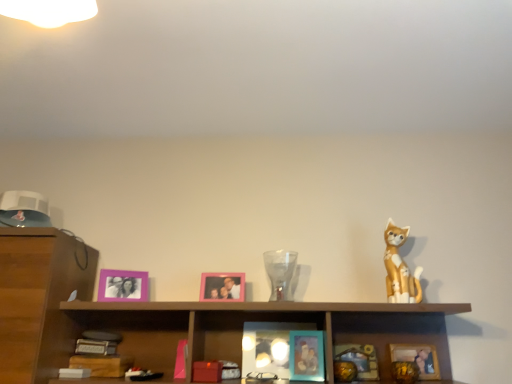
This screenshot has height=384, width=512. Find the location of `free space in front of purple matte picture frame at upper left, the fifth picture frame positioned from the right`. free space in front of purple matte picture frame at upper left, the fifth picture frame positioned from the right is located at coordinates (117, 303).